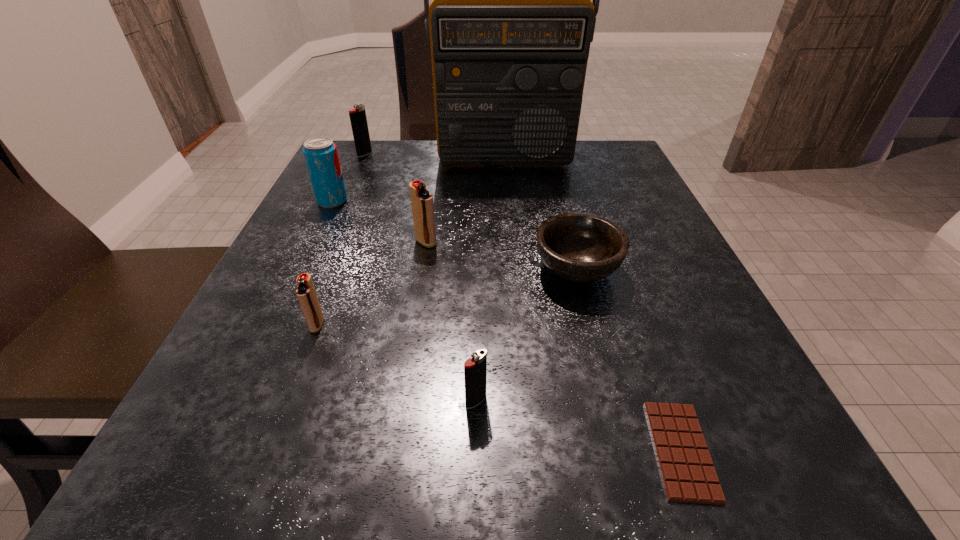
What are the coordinates of `object located in the far right corner section of the desktop` in the screenshot? It's located at (511, 22).

Locate an element on the screen. This screenshot has height=540, width=960. object that is at the near right corner is located at coordinates (688, 474).

In the image, there is a desktop. Identify the location of vacant space at the far edge. (555, 171).

I want to click on free spot at the near edge of the desktop, so click(588, 462).

Locate an element on the screen. This screenshot has width=960, height=540. vacant space at the left edge of the desktop is located at coordinates (254, 307).

Find the location of `free location at the right edge`. free location at the right edge is located at coordinates (666, 367).

In order to click on vacant space at the far left corner of the desktop in this screenshot , I will do `click(358, 172)`.

The width and height of the screenshot is (960, 540). Find the location of `free spot at the far right corner of the desktop`. free spot at the far right corner of the desktop is located at coordinates (615, 151).

Locate an element on the screen. This screenshot has height=540, width=960. free space between the leftmost igniter and the soda can is located at coordinates (348, 178).

Identify the location of free space between the radio receiver and the rightmost igniter. This screenshot has height=540, width=960. (491, 280).